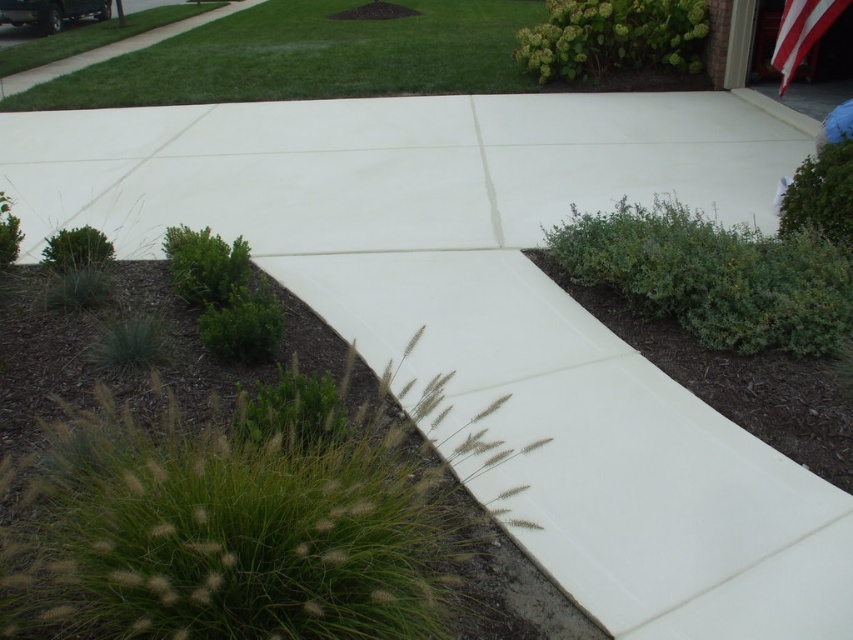
You are standing at the entrance of the driveway and want to walk towards the house. There are two points marked on the driveway. One is at point [189,96] and the other is at point [799,35]. Which point will you reach first as you walk towards the house?

Point [189,96] is further to the camera than point [799,35], so you will reach point [799,35] first as you walk towards the house.

You are standing at the point labeled point (310,58). Looking around, you see the driveway with its white concrete and the shrubs along the edges. What type of terrain are you currently standing on?

The point (310,58) is on green grass at upper center, so you are standing on green grass.